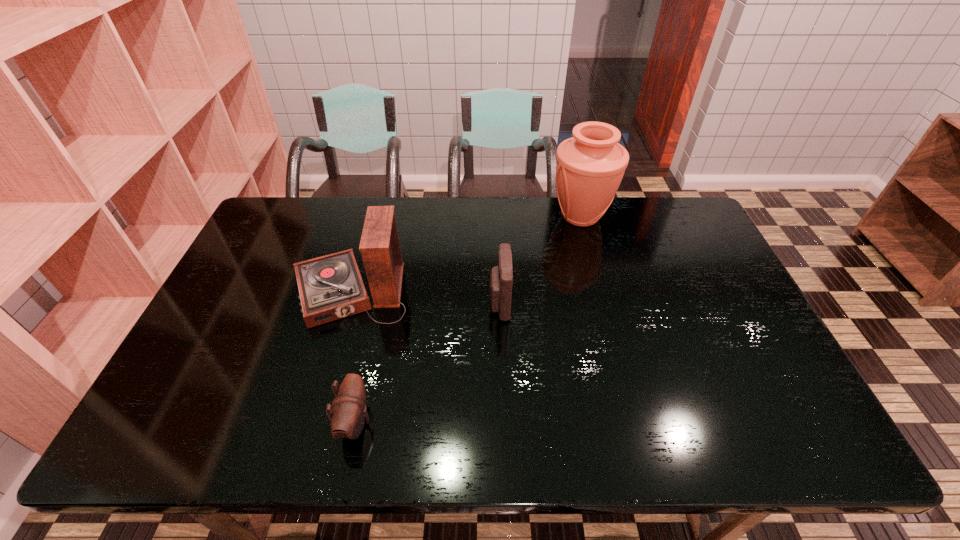
Identify the location of vacant space at the far right corner of the desktop. This screenshot has height=540, width=960. (661, 200).

I want to click on vacant space at the near right corner, so click(768, 417).

Where is `vacant point located between the third shortest object and the nearer pouch`? This screenshot has width=960, height=540. vacant point located between the third shortest object and the nearer pouch is located at coordinates (352, 357).

The image size is (960, 540). I want to click on vacant region between the nearer pouch and the second tallest object, so click(x=352, y=357).

Locate an element on the screen. free point between the phonograph record and the shorter pouch is located at coordinates (352, 357).

Where is `free space between the phonograph record and the shorter pouch`? free space between the phonograph record and the shorter pouch is located at coordinates (352, 357).

This screenshot has width=960, height=540. I want to click on vacant point located between the rightmost object and the nearest object, so (x=468, y=319).

Find the location of `free space between the right pouch and the farthest object`. free space between the right pouch and the farthest object is located at coordinates (540, 260).

This screenshot has height=540, width=960. In order to click on vacant space that's between the nearer pouch and the third shortest object in this screenshot , I will do `click(352, 357)`.

Where is `vacant area between the nearer pouch and the taller pouch`? vacant area between the nearer pouch and the taller pouch is located at coordinates (427, 363).